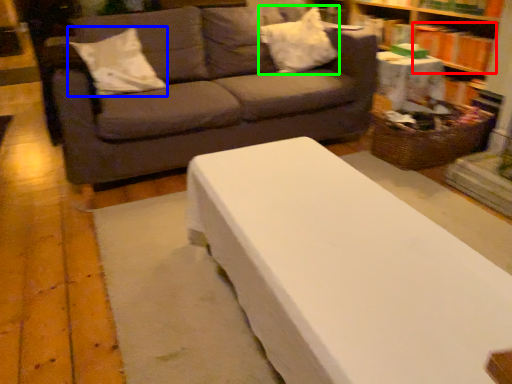
Question: Which is nearer to the book (highlighted by a red box)? pillow (highlighted by a blue box) or pillow (highlighted by a green box).

Choices:
 (A) pillow
 (B) pillow

Answer: (B)